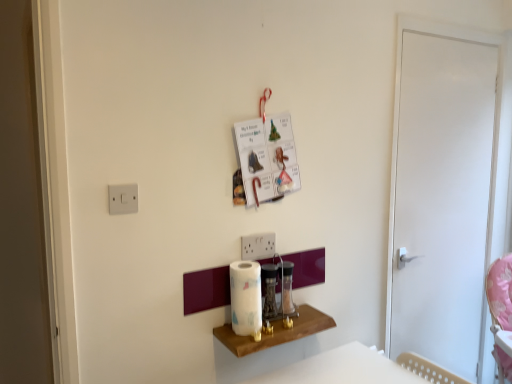
Question: Is white glossy paper towel at center positioned with its back to metallic silver blender at center, placed as the 2th appliance when sorted from right to left?

Choices:
 (A) no
 (B) yes

Answer: (A)

Question: Would you consider white glossy paper towel at center to be distant from metallic silver blender at center, placed as the first appliance when sorted from left to right?

Choices:
 (A) no
 (B) yes

Answer: (A)

Question: From a real-world perspective, is white glossy paper towel at center located beneath metallic silver blender at center, placed as the 2th appliance when sorted from right to left?

Choices:
 (A) no
 (B) yes

Answer: (A)

Question: Is white glossy paper towel at center shorter than metallic silver blender at center, placed as the 2th appliance when sorted from right to left?

Choices:
 (A) yes
 (B) no

Answer: (B)

Question: Is white glossy paper towel at center to the right of metallic silver blender at center, placed as the 2th appliance when sorted from right to left, from the viewer's perspective?

Choices:
 (A) no
 (B) yes

Answer: (A)

Question: From a real-world perspective, is white glossy paper towel at center on metallic silver blender at center, placed as the first appliance when sorted from left to right?

Choices:
 (A) no
 (B) yes

Answer: (B)

Question: From a real-world perspective, is metallic silver blender at center, placed as the first appliance when sorted from left to right, physically below white glossy door at right?

Choices:
 (A) yes
 (B) no

Answer: (A)

Question: Is metallic silver blender at center, placed as the first appliance when sorted from left to right, beside white glossy door at right?

Choices:
 (A) no
 (B) yes

Answer: (A)

Question: Considering the relative sizes of metallic silver blender at center, placed as the first appliance when sorted from left to right, and white glossy door at right in the image provided, is metallic silver blender at center, placed as the first appliance when sorted from left to right, taller than white glossy door at right?

Choices:
 (A) no
 (B) yes

Answer: (A)

Question: Considering the relative positions of metallic silver blender at center, placed as the first appliance when sorted from left to right, and white glossy door at right in the image provided, is metallic silver blender at center, placed as the first appliance when sorted from left to right, to the right of white glossy door at right from the viewer's perspective?

Choices:
 (A) yes
 (B) no

Answer: (B)

Question: Is white glossy door at right inside metallic silver blender at center, placed as the first appliance when sorted from left to right?

Choices:
 (A) no
 (B) yes

Answer: (A)

Question: From the image's perspective, is metallic silver blender at center, placed as the first appliance when sorted from left to right, beneath white glossy door at right?

Choices:
 (A) no
 (B) yes

Answer: (B)

Question: From a real-world perspective, is metallic silver blender at center, placed as the first appliance when sorted from left to right, located higher than white glossy paper towel at center?

Choices:
 (A) no
 (B) yes

Answer: (A)